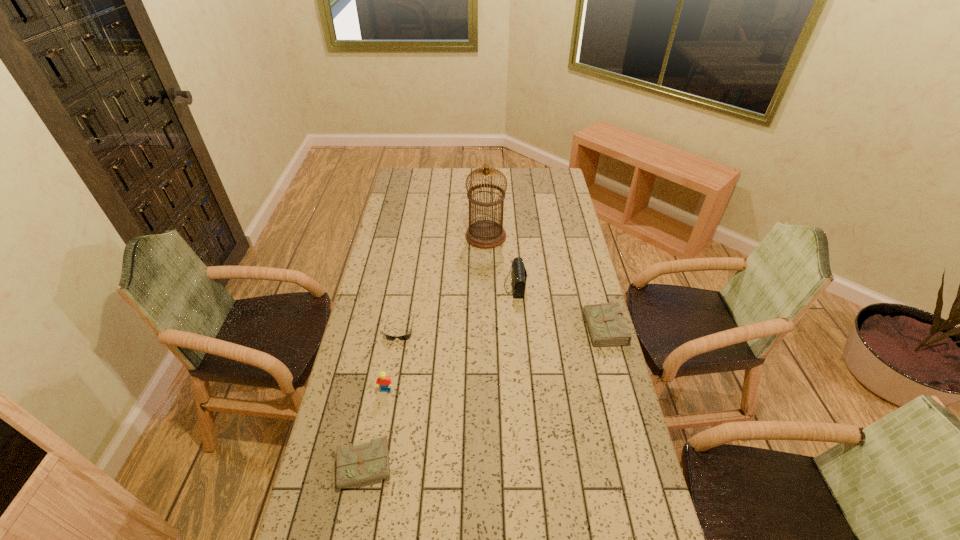
Locate an element on the screen. The width and height of the screenshot is (960, 540). sunglasses situated at the left edge is located at coordinates (405, 337).

Where is `Lego that is positioned at the left edge`? Lego that is positioned at the left edge is located at coordinates (383, 380).

I want to click on object present at the right edge, so click(606, 327).

Where is `free region at the far edge of the desktop`? free region at the far edge of the desktop is located at coordinates (434, 179).

The width and height of the screenshot is (960, 540). Find the location of `free space at the near edge of the desktop`. free space at the near edge of the desktop is located at coordinates (541, 536).

In the image, there is a desktop. Where is `vacant space at the left edge`? vacant space at the left edge is located at coordinates (406, 264).

You are a GUI agent. You are given a task and a screenshot of the screen. Output one action in this format:
    pyautogui.click(x=<x>, y=<y>)
    Task: Click on the vacant space at the right edge
    
    Given the screenshot: What is the action you would take?
    pyautogui.click(x=594, y=431)

I want to click on vacant point at the far left corner, so click(418, 189).

Find the location of `vacant space at the near left corner of the desktop`. vacant space at the near left corner of the desktop is located at coordinates (337, 536).

Find the location of `vacant space at the far right corner of the desktop`. vacant space at the far right corner of the desktop is located at coordinates (536, 183).